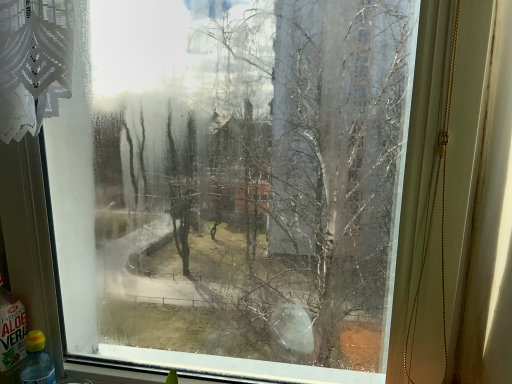
Question: Should I look upward or downward to see translucent plastic bottle at lower left, which is counted as the 1th bottle, starting from the left?

Choices:
 (A) up
 (B) down

Answer: (B)

Question: From a real-world perspective, is translucent plastic bottle at lower left, marked as the second bottle in a left-to-right arrangement, located beneath translucent plastic bottle at lower left, which is counted as the 1th bottle, starting from the left?

Choices:
 (A) no
 (B) yes

Answer: (B)

Question: Is translucent plastic bottle at lower left, marked as the second bottle in a left-to-right arrangement, facing towards translucent plastic bottle at lower left, which is counted as the 1th bottle, starting from the left?

Choices:
 (A) yes
 (B) no

Answer: (B)

Question: Is translucent plastic bottle at lower left, the 1th bottle when ordered from right to left, located outside translucent plastic bottle at lower left, which is counted as the 1th bottle, starting from the left?

Choices:
 (A) yes
 (B) no

Answer: (A)

Question: Is translucent plastic bottle at lower left, the 1th bottle when ordered from right to left, turned away from translucent plastic bottle at lower left, which is counted as the 1th bottle, starting from the left?

Choices:
 (A) no
 (B) yes

Answer: (A)

Question: From the image's perspective, is translucent plastic bottle at lower left, the 1th bottle when ordered from right to left, below translucent plastic bottle at lower left, which ranks as the second bottle in right-to-left order?

Choices:
 (A) no
 (B) yes

Answer: (B)

Question: Considering the relative sizes of translucent plastic bottle at lower left, the 1th bottle when ordered from right to left, and translucent plastic bottle at lower left, which is counted as the 1th bottle, starting from the left, in the image provided, is translucent plastic bottle at lower left, the 1th bottle when ordered from right to left, bigger than translucent plastic bottle at lower left, which is counted as the 1th bottle, starting from the left,?

Choices:
 (A) yes
 (B) no

Answer: (B)

Question: Is translucent plastic bottle at lower left, which is counted as the 1th bottle, starting from the left, at the left side of translucent plastic bottle at lower left, marked as the second bottle in a left-to-right arrangement?

Choices:
 (A) yes
 (B) no

Answer: (A)

Question: From a real-world perspective, is translucent plastic bottle at lower left, which is counted as the 1th bottle, starting from the left, under translucent plastic bottle at lower left, marked as the second bottle in a left-to-right arrangement?

Choices:
 (A) no
 (B) yes

Answer: (A)

Question: Is translucent plastic bottle at lower left, which ranks as the second bottle in right-to-left order, wider than translucent plastic bottle at lower left, the 1th bottle when ordered from right to left?

Choices:
 (A) no
 (B) yes

Answer: (B)

Question: From the image's perspective, is translucent plastic bottle at lower left, which ranks as the second bottle in right-to-left order, above translucent plastic bottle at lower left, marked as the second bottle in a left-to-right arrangement?

Choices:
 (A) yes
 (B) no

Answer: (A)

Question: Considering the relative sizes of translucent plastic bottle at lower left, which is counted as the 1th bottle, starting from the left, and translucent plastic bottle at lower left, marked as the second bottle in a left-to-right arrangement, in the image provided, is translucent plastic bottle at lower left, which is counted as the 1th bottle, starting from the left, thinner than translucent plastic bottle at lower left, marked as the second bottle in a left-to-right arrangement,?

Choices:
 (A) no
 (B) yes

Answer: (A)

Question: Is translucent plastic bottle at lower left, the 1th bottle when ordered from right to left, surrounded by translucent plastic bottle at lower left, which is counted as the 1th bottle, starting from the left?

Choices:
 (A) yes
 (B) no

Answer: (B)

Question: Based on their sizes in the image, would you say translucent plastic bottle at lower left, marked as the second bottle in a left-to-right arrangement, is bigger or smaller than translucent plastic bottle at lower left, which is counted as the 1th bottle, starting from the left?

Choices:
 (A) small
 (B) big

Answer: (A)